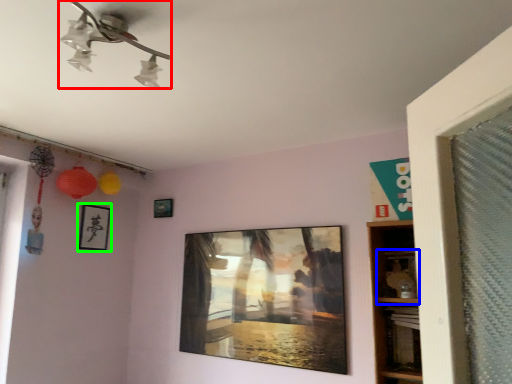
Question: Estimate the real-world distances between objects in this image. Which object is closer to lamp (highlighted by a red box), shelf (highlighted by a blue box) or picture frame (highlighted by a green box)?

Choices:
 (A) shelf
 (B) picture frame

Answer: (A)